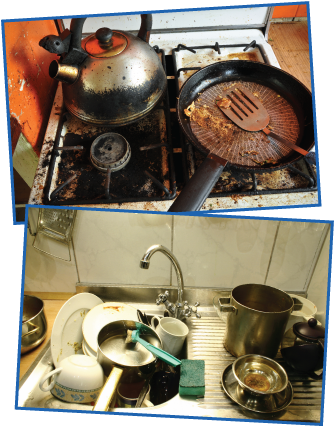
Locate an element on the screen. This screenshot has height=427, width=335. filthy stovetop is located at coordinates (133, 171).